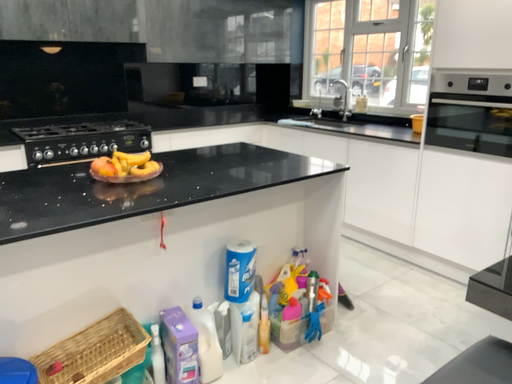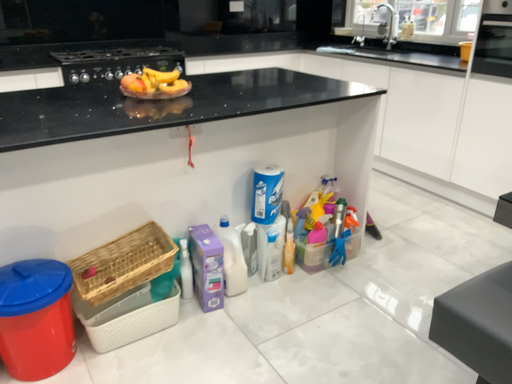
Question: Which way did the camera rotate in the video?

Choices:
 (A) rotated upward
 (B) rotated downward

Answer: (B)